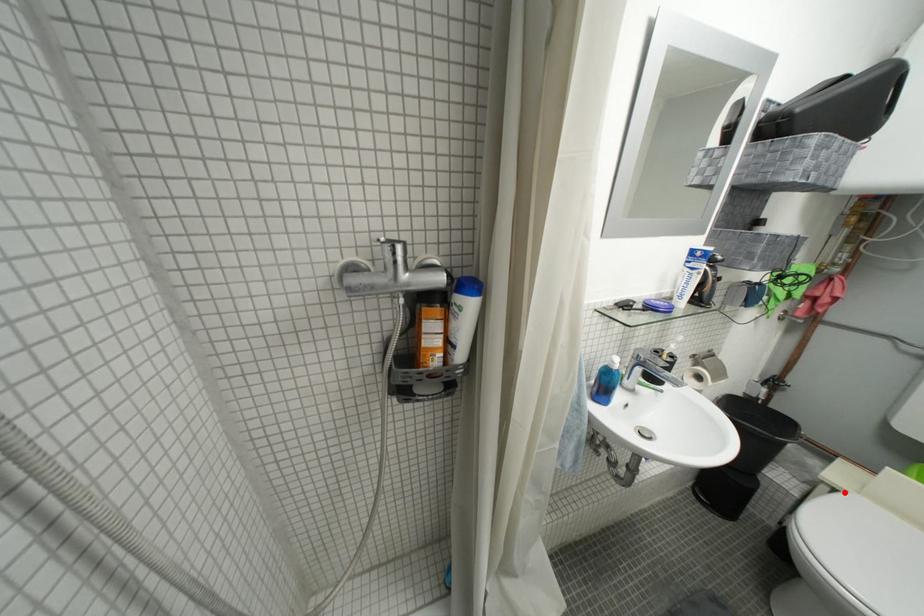
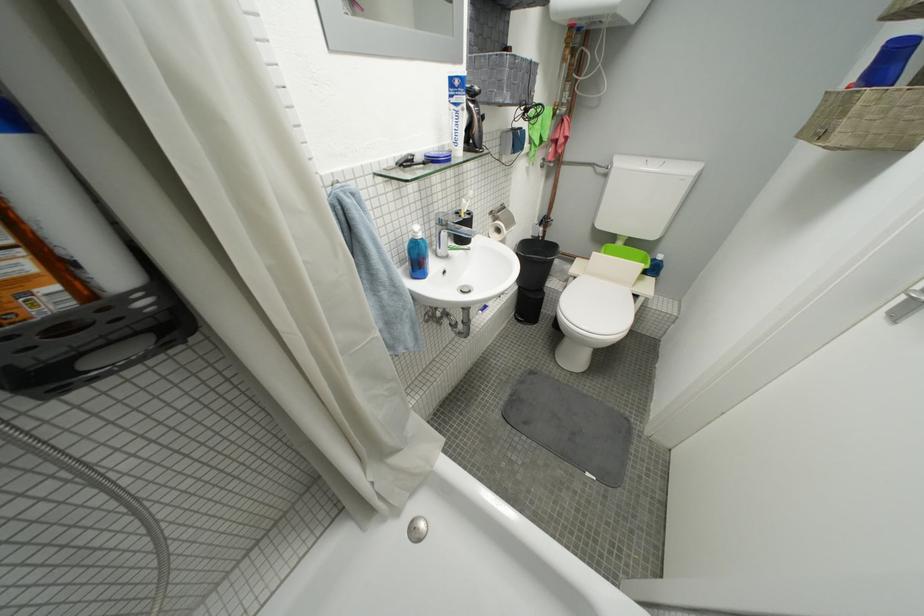
Question: A red point is marked in image1. In image2, is the corresponding 3D point closer to the camera or farther? Reply with the corresponding letter.

Choices:
 (A) The corresponding 3D point is closer.
 (B) The corresponding 3D point is farther.

Answer: (A)